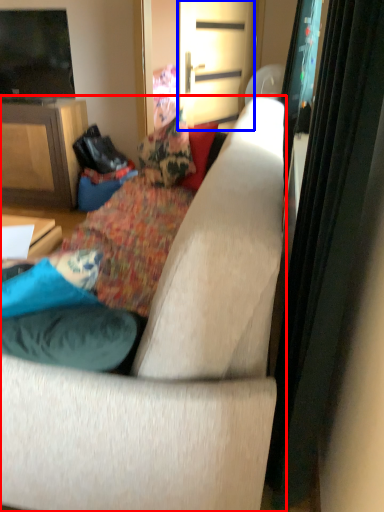
Question: Which object is further to the camera taking this photo, studio couch (highlighted by a red box) or screen door (highlighted by a blue box)?

Choices:
 (A) studio couch
 (B) screen door

Answer: (B)